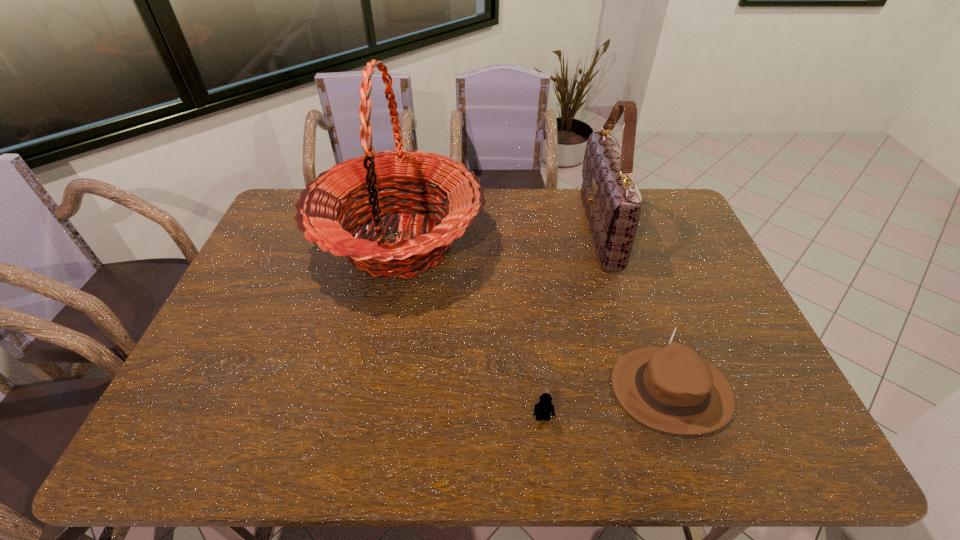
Image resolution: width=960 pixels, height=540 pixels. Identify the location of vacant region located on the feather side of the fedora. (473, 389).

At what (x,y) coordinates should I click in order to perform the action: click on vacant position located 0.250m on the feather side of the fedora. Please return your answer as a coordinate pair (x, y). The height and width of the screenshot is (540, 960). Looking at the image, I should click on (510, 389).

Where is `free space located 0.130m on the feather side of the fedora`? free space located 0.130m on the feather side of the fedora is located at coordinates (559, 389).

This screenshot has height=540, width=960. Find the location of `vacant region located 0.060m on the front-facing side of the second object from left to right`. vacant region located 0.060m on the front-facing side of the second object from left to right is located at coordinates (546, 451).

The image size is (960, 540). In order to click on basket positioned at the far edge in this screenshot , I will do `click(320, 209)`.

Where is `handbag present at the far edge`? handbag present at the far edge is located at coordinates (612, 201).

The width and height of the screenshot is (960, 540). Find the location of `fedora that is at the near edge`. fedora that is at the near edge is located at coordinates pos(671,388).

The height and width of the screenshot is (540, 960). What are the coordinates of `Lego present at the near edge` in the screenshot? It's located at 544,407.

Locate an element on the screen. Image resolution: width=960 pixels, height=540 pixels. object that is positioned at the right edge is located at coordinates (671, 388).

At what (x,y) coordinates should I click in order to perform the action: click on object that is at the near right corner. Please return your answer as a coordinate pair (x, y). The width and height of the screenshot is (960, 540). Looking at the image, I should click on (671, 388).